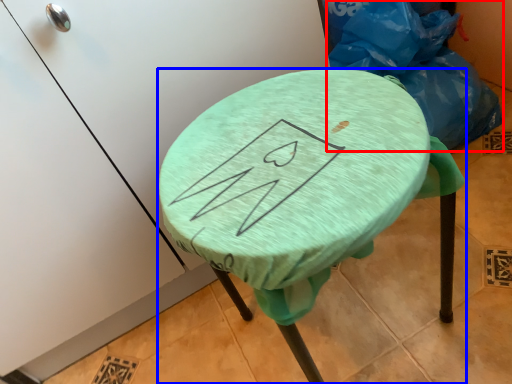
Question: Which of the following is the farthest to the observer, garbage (highlighted by a red box) or furniture (highlighted by a blue box)?

Choices:
 (A) garbage
 (B) furniture

Answer: (A)